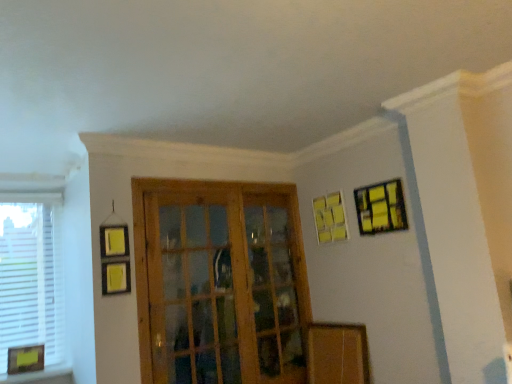
Question: From the image's perspective, is wooden screen door at center below white matte window at left?

Choices:
 (A) no
 (B) yes

Answer: (B)

Question: Does wooden screen door at center have a lesser height compared to white matte window at left?

Choices:
 (A) yes
 (B) no

Answer: (B)

Question: Does wooden screen door at center appear on the left side of white matte window at left?

Choices:
 (A) yes
 (B) no

Answer: (B)

Question: Can you confirm if wooden screen door at center is positioned to the right of white matte window at left?

Choices:
 (A) no
 (B) yes

Answer: (B)

Question: Can you confirm if wooden screen door at center is thinner than white matte window at left?

Choices:
 (A) no
 (B) yes

Answer: (A)

Question: From a real-world perspective, does wooden screen door at center sit lower than white matte window at left?

Choices:
 (A) yes
 (B) no

Answer: (A)

Question: Is white matte window at left surrounding wooden screen door at center?

Choices:
 (A) yes
 (B) no

Answer: (B)

Question: From a real-world perspective, is white matte window at left beneath wooden screen door at center?

Choices:
 (A) no
 (B) yes

Answer: (A)

Question: Is white matte window at left shorter than wooden screen door at center?

Choices:
 (A) no
 (B) yes

Answer: (B)

Question: Is white matte window at left oriented away from wooden screen door at center?

Choices:
 (A) no
 (B) yes

Answer: (A)

Question: Is white matte window at left to the right of wooden screen door at center from the viewer's perspective?

Choices:
 (A) no
 (B) yes

Answer: (A)

Question: From the image's perspective, is white matte window at left below wooden screen door at center?

Choices:
 (A) no
 (B) yes

Answer: (A)

Question: Is yellow matte picture frame at lower left, placed as the third picture frame when sorted from top to bottom, positioned beyond the bounds of yellow matte picture frame at upper right, the 1th picture frame viewed from the top?

Choices:
 (A) yes
 (B) no

Answer: (A)